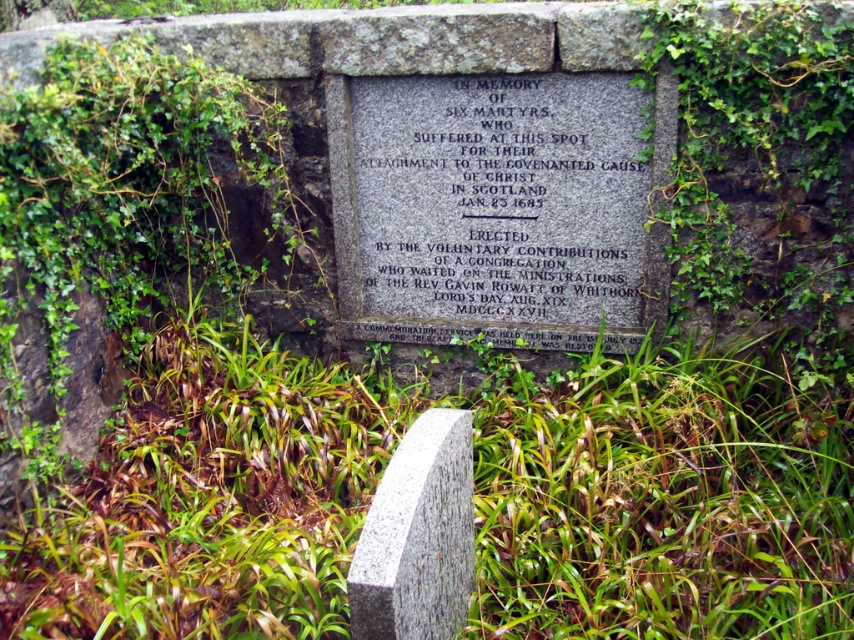
Question: Which of the following is the closest to the observer?

Choices:
 (A) (162, 563)
 (B) (399, 547)

Answer: (B)

Question: Does gray stone plaque at center have a larger size compared to granite gravestone at center?

Choices:
 (A) yes
 (B) no

Answer: (A)

Question: Which of the following is the farthest from the observer?

Choices:
 (A) green grass at center
 (B) granite gravestone at center
 (C) gray stone plaque at center

Answer: (C)

Question: Which object appears closest to the camera in this image?

Choices:
 (A) green grass at center
 (B) gray stone plaque at center
 (C) granite gravestone at center

Answer: (C)

Question: Does green grass at center have a greater width compared to granite gravestone at center?

Choices:
 (A) yes
 (B) no

Answer: (A)

Question: Does green grass at center appear over gray stone plaque at center?

Choices:
 (A) no
 (B) yes

Answer: (A)